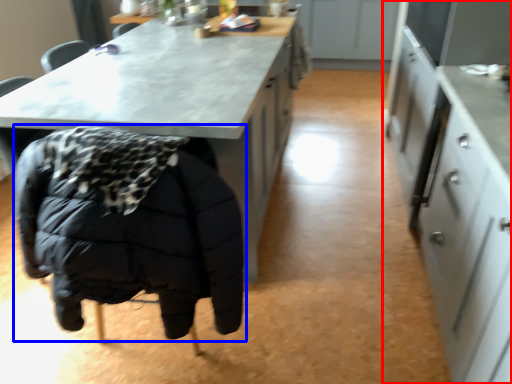
Question: Which object appears closest to the camera in this image, cabinetry (highlighted by a red box) or jacket (highlighted by a blue box)?

Choices:
 (A) cabinetry
 (B) jacket

Answer: (A)